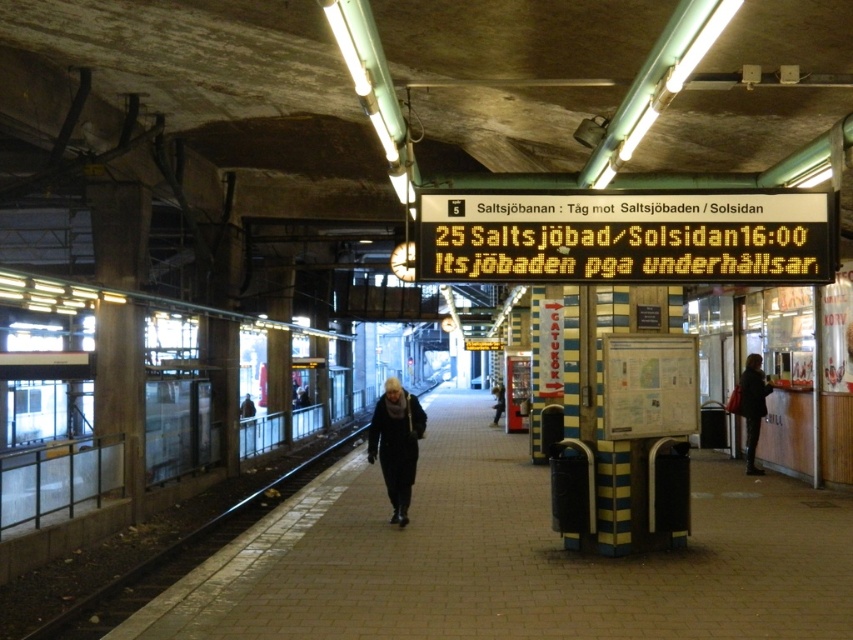
Does black metal train track at left have a lesser width compared to dark gray jacket at left?

No.

Can you confirm if black metal train track at left is positioned to the left of dark gray jacket at left?

No, black metal train track at left is not to the left of dark gray jacket at left.

Who is more distant from viewer, (131, 577) or (242, 410)?

Positioned behind is point (242, 410).

Where is `black metal train track at left`? black metal train track at left is located at coordinates (154, 552).

Does black metal train track at left have a larger size compared to dark blue coat at center?

Actually, black metal train track at left might be smaller than dark blue coat at center.

Which is above, black metal train track at left or dark blue coat at center?

dark blue coat at center is above.

Is point (206, 541) positioned in front of point (370, 451)?

No.

The image size is (853, 640). I want to click on black metal train track at left, so click(154, 552).

From the picture: Does yellow digital display at center have a greater height compared to dark gray coat at right?

No, yellow digital display at center is not taller than dark gray coat at right.

Locate an element on the screen. The height and width of the screenshot is (640, 853). yellow digital display at center is located at coordinates (627, 237).